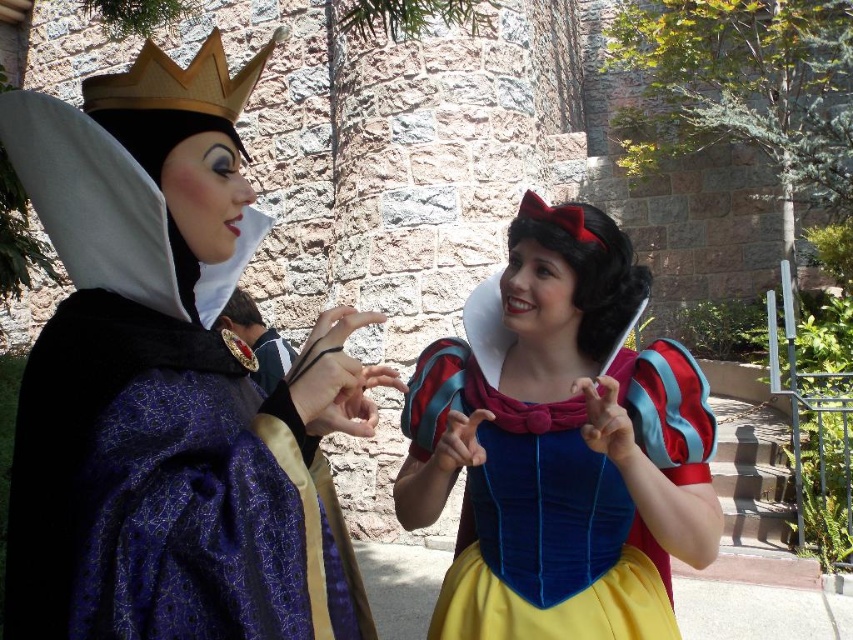
You are a photographer standing at a certain distance. You want to take a closeup photo of the shiny purple gown at left. Is it possible to capture the entire gown in the frame without moving closer?

The shiny purple gown at left is 21.24 meters away from the viewer. Since this distance is quite far, it may be challenging to capture the entire gown in a closeup photo without moving closer. A telephoto lens might help, but the photographer would likely need to adjust their position or use additional equipment to ensure the gown fills the frame appropriately.

You are a photographer at a costume party. You need to position the camera so that both the shiny purple gown at left and the gold metallic crown at upper left are in frame. Based on their positions, which object should you focus on first to ensure both are visible?

The shiny purple gown at left is below the gold metallic crown at upper left. To ensure both are visible, focus on the gold metallic crown at upper left first as it is higher up, then adjust the camera angle to include the gown below.

You are standing in front of the image and want to determine which of the two points, point (239,154) or point (505,461), is nearer to you. Based on the scene, which point is closer?

Point (239,154) is closer to the viewer than point (505,461).